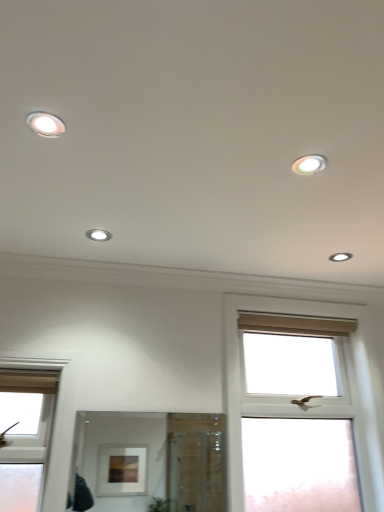
How much space does white glossy light fixture at upper right, the first dot positioned from the back, occupy horizontally?

white glossy light fixture at upper right, the first dot positioned from the back, is 3.96 inches wide.

Describe the element at coordinates (155, 461) in the screenshot. I see `clear glass mirror at center` at that location.

What is the approximate height of white glossy light fixture at center, the 2th dot when ordered from front to back?

white glossy light fixture at center, the 2th dot when ordered from front to back, is 0.79 inches tall.

This screenshot has height=512, width=384. What are the coordinates of `white plastic window at center right, the first window in the right-to-left sequence` in the screenshot? It's located at (304, 393).

The image size is (384, 512). I want to click on white glossy light fixture at upper right, the third dot when ordered from front to back, so click(x=340, y=257).

Which is behind, clear glass mirror at center or white plastic window at center right, the first window in the right-to-left sequence?

white plastic window at center right, the first window in the right-to-left sequence, is further from the camera.

From the image's perspective, is clear glass mirror at center located above or below white plastic window at center right, acting as the second window starting from the left?

clear glass mirror at center is situated lower than white plastic window at center right, acting as the second window starting from the left, in the image.

Can you tell me how much clear glass mirror at center and white plastic window at center right, acting as the second window starting from the left, differ in facing direction?

1.18 degrees separate the facing orientations of clear glass mirror at center and white plastic window at center right, acting as the second window starting from the left.

Does clear glass mirror at center have a greater height compared to white plastic window at center right, the first window in the right-to-left sequence?

No.

Which is nearer, (101, 431) or (307, 170)?

Point (101, 431) is farther from the camera than point (307, 170).

Looking at this image, could you tell me if clear glass mirror at center is facing white glossy light fixture at upper right, marked as the third dot in a bottom-to-top arrangement?

No, clear glass mirror at center is not facing towards white glossy light fixture at upper right, marked as the third dot in a bottom-to-top arrangement.

Is clear glass mirror at center next to white glossy light fixture at upper right, the 2th dot positioned from the right?

clear glass mirror at center and white glossy light fixture at upper right, the 2th dot positioned from the right, are not in contact.

Is point (375, 473) closer or farther from the camera than point (103, 241)?

Point (375, 473) is positioned farther from the camera compared to point (103, 241).

Between white plastic window at center right, acting as the second window starting from the left, and white glossy light fixture at center, the 2th dot when ordered from front to back, which one has smaller size?

white glossy light fixture at center, the 2th dot when ordered from front to back, is smaller.

Where is `dot that is the 1st one when counting forward from the white plastic window at center right, acting as the second window starting from the left`? The image size is (384, 512). dot that is the 1st one when counting forward from the white plastic window at center right, acting as the second window starting from the left is located at coordinates (99, 234).

Is white plastic window at center right, acting as the second window starting from the left, placed right next to white glossy light fixture at center, the 2th dot when ordered from front to back?

No, white plastic window at center right, acting as the second window starting from the left, is not in contact with white glossy light fixture at center, the 2th dot when ordered from front to back.

Who is more distant, clear glass mirror at center or white glossy light fixture at upper right, which appears as the 1th dot when viewed from the right?

white glossy light fixture at upper right, which appears as the 1th dot when viewed from the right, is more distant.

From their relative heights in the image, would you say clear glass mirror at center is taller or shorter than white glossy light fixture at upper right, which is the 1th dot from bottom to top?

Clearly, clear glass mirror at center is taller compared to white glossy light fixture at upper right, which is the 1th dot from bottom to top.

Can you confirm if clear glass mirror at center is bigger than white glossy light fixture at upper right, which is the 1th dot from bottom to top?

Indeed, clear glass mirror at center has a larger size compared to white glossy light fixture at upper right, which is the 1th dot from bottom to top.

From the image's perspective, is white plastic window at center right, the first window in the right-to-left sequence, located above white glossy light fixture at upper right, positioned as the third dot in left-to-right order?

No, from the image's perspective, white plastic window at center right, the first window in the right-to-left sequence, is not on top of white glossy light fixture at upper right, positioned as the third dot in left-to-right order.

Considering the positions of objects white plastic window at center right, acting as the second window starting from the left, and white glossy light fixture at upper right, positioned as the third dot in left-to-right order, in the image provided, who is more to the left, white plastic window at center right, acting as the second window starting from the left, or white glossy light fixture at upper right, positioned as the third dot in left-to-right order,?

From the viewer's perspective, white plastic window at center right, acting as the second window starting from the left, appears more on the left side.

From a real-world perspective, is white plastic window at center right, the first window in the right-to-left sequence, physically located above or below white glossy light fixture at upper right, which is the 1th dot from bottom to top?

white plastic window at center right, the first window in the right-to-left sequence, is situated lower than white glossy light fixture at upper right, which is the 1th dot from bottom to top, in the real world.

Is white plastic window at center right, the first window in the right-to-left sequence, placed right next to white glossy light fixture at upper right, the third dot when ordered from front to back?

No, white plastic window at center right, the first window in the right-to-left sequence, is not beside white glossy light fixture at upper right, the third dot when ordered from front to back.

What's the angular difference between matte white window at left, the first window positioned from the left, and white glossy light fixture at upper right, the third dot when ordered from front to back,'s facing directions?

They differ by 1.11 degrees in their facing directions.

Is matte white window at left, the first window positioned from the left, positioned far away from white glossy light fixture at upper right, the first dot positioned from the back?

matte white window at left, the first window positioned from the left, is far away from white glossy light fixture at upper right, the first dot positioned from the back.

Starting from the matte white window at left, the first window positioned from the left, which dot is the 3rd one to the right? Please provide its 2D coordinates.

[(340, 257)]

From the image's perspective, is matte white window at left, the first window positioned from the left, on top of white glossy light fixture at upper right, positioned as the third dot in left-to-right order?

Incorrect, from the image's perspective, matte white window at left, the first window positioned from the left, is lower than white glossy light fixture at upper right, positioned as the third dot in left-to-right order.

Is point (313, 170) farther from camera compared to point (32, 452)?

No, it is in front of (32, 452).

Is white glossy light fixture at upper right, which is the first dot from front to back, positioned with its back to matte white window at left, which ranks as the second window in right-to-left order?

white glossy light fixture at upper right, which is the first dot from front to back, does not have its back to matte white window at left, which ranks as the second window in right-to-left order.

Find the location of a particular element. Image resolution: width=384 pixels, height=512 pixels. window lying on the right of clear glass mirror at center is located at coordinates (304, 393).

Locate an element on the screen. mirror that is under the white glossy light fixture at upper right, marked as the third dot in a bottom-to-top arrangement (from a real-world perspective) is located at coordinates (155, 461).

When comparing their distances from matte white window at left, the first window positioned from the left, does clear glass mirror at center or white glossy light fixture at center, which is the 1th dot from left to right, seem closer?

white glossy light fixture at center, which is the 1th dot from left to right, is closer to matte white window at left, the first window positioned from the left.

Based on their spatial positions, is white glossy light fixture at upper right, the third dot when ordered from front to back, or white glossy light fixture at upper right, the 1th dot positioned from the top, closer to matte white window at left, which ranks as the second window in right-to-left order?

white glossy light fixture at upper right, the 1th dot positioned from the top.

Looking at the image, which one is located further to matte white window at left, which ranks as the second window in right-to-left order, clear glass mirror at center or white plastic window at center right, the first window in the right-to-left sequence?

Among the two, clear glass mirror at center is located further to matte white window at left, which ranks as the second window in right-to-left order.

Which object lies nearer to the anchor point white glossy light fixture at center, the third dot from the right, white glossy light fixture at upper right, which appears as the 1th dot when viewed from the right, or white glossy light fixture at upper right, which is the first dot from front to back?

white glossy light fixture at upper right, which is the first dot from front to back, is positioned closer to the anchor white glossy light fixture at center, the third dot from the right.

Estimate the real-world distances between objects in this image. Which object is closer to matte white window at left, which ranks as the second window in right-to-left order, white glossy light fixture at center, which ranks as the 2th dot in top-to-bottom order, or white glossy light fixture at upper right, the 2th dot positioned from the right?

Based on the image, white glossy light fixture at center, which ranks as the 2th dot in top-to-bottom order, appears to be nearer to matte white window at left, which ranks as the second window in right-to-left order.

Looking at the image, which one is located further to white glossy light fixture at center, the 2th dot when ordered from front to back, white plastic window at center right, acting as the second window starting from the left, or clear glass mirror at center?

The object further to white glossy light fixture at center, the 2th dot when ordered from front to back, is clear glass mirror at center.

Considering their positions, is matte white window at left, the first window positioned from the left, positioned closer to white glossy light fixture at center, the third dot from the right, than white glossy light fixture at upper right, which appears as the 1th dot when viewed from the right?

matte white window at left, the first window positioned from the left, is closer to white glossy light fixture at center, the third dot from the right.

Which object lies nearer to the anchor point white glossy light fixture at center, the second dot positioned from the back, white glossy light fixture at upper right, the third dot when ordered from back to front, or white glossy light fixture at upper right, which appears as the 1th dot when viewed from the right?

Based on the image, white glossy light fixture at upper right, the third dot when ordered from back to front, appears to be nearer to white glossy light fixture at center, the second dot positioned from the back.

At what (x,y) coordinates should I click in order to perform the action: click on mirror located between matte white window at left, the first window positioned from the left, and white glossy light fixture at upper right, placed as the 3th dot when sorted from top to bottom, in the left-right direction. Please return your answer as a coordinate pair (x, y). The image size is (384, 512). Looking at the image, I should click on (155, 461).

You are a GUI agent. You are given a task and a screenshot of the screen. Output one action in this format:
    pyautogui.click(x=<x>, y=<y>)
    Task: Click on the mirror situated between matte white window at left, the first window positioned from the left, and white plastic window at center right, the first window in the right-to-left sequence, from left to right
    The image size is (384, 512).
    Given the screenshot: What is the action you would take?
    pyautogui.click(x=155, y=461)

Identify the location of window between white glossy light fixture at center, which is the 1th dot from left to right, and white glossy light fixture at upper right, the first dot positioned from the back, in the horizontal direction. The width and height of the screenshot is (384, 512). (304, 393).

Image resolution: width=384 pixels, height=512 pixels. What are the coordinates of `mirror between white glossy light fixture at center, which ranks as the 2th dot in top-to-bottom order, and white glossy light fixture at upper right, positioned as the third dot in left-to-right order` in the screenshot? It's located at (155, 461).